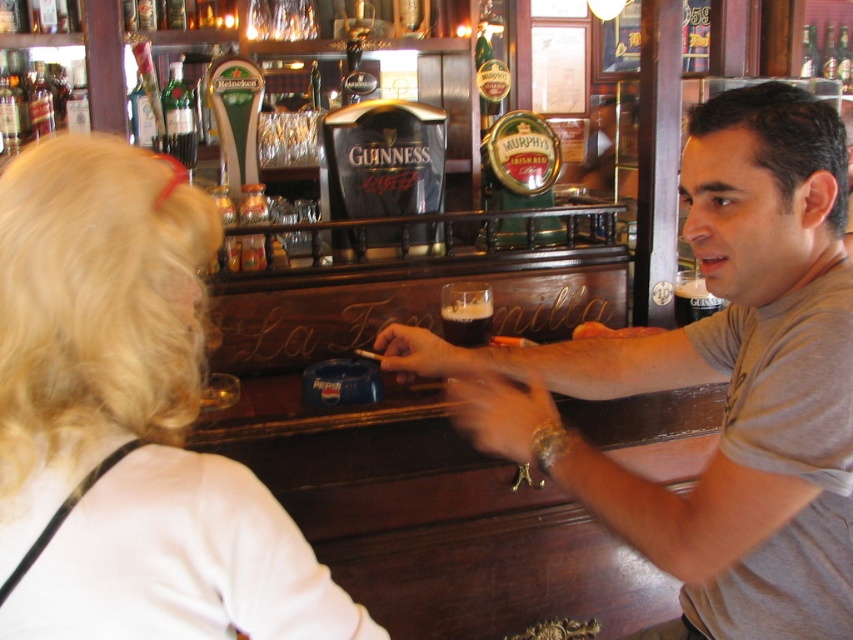
Question: Is blonde hair at upper left below green glass bottle at upper left?

Choices:
 (A) yes
 (B) no

Answer: (A)

Question: Does matte gray shirt at center have a lesser width compared to green glass bottle at upper left?

Choices:
 (A) yes
 (B) no

Answer: (B)

Question: Which object is the farthest from the blonde hair at upper left?

Choices:
 (A) dark brown liquid at bar center
 (B) green glass bottle at upper left
 (C) dark matte glass at center

Answer: (A)

Question: Among these objects, which one is nearest to the camera?

Choices:
 (A) green glass bottle at upper left
 (B) dark brown liquid at bar center
 (C) dark matte glass at center

Answer: (C)

Question: Which of the following is the closest to the observer?

Choices:
 (A) tap(178, 157)
 (B) tap(165, 502)

Answer: (B)

Question: Is matte gray shirt at center smaller than green glass bottle at upper left?

Choices:
 (A) yes
 (B) no

Answer: (B)